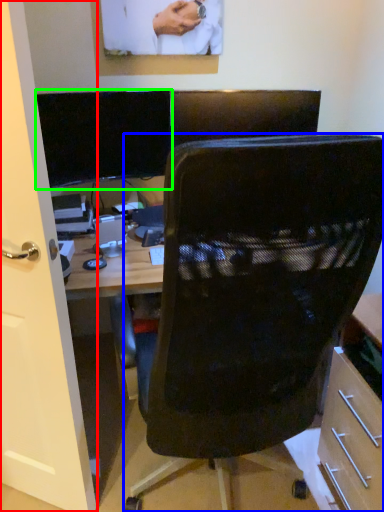
Question: Which object is the closest to the glass door (highlighted by a red box)? Choose among these: chair (highlighted by a blue box) or computer monitor (highlighted by a green box).

Choices:
 (A) chair
 (B) computer monitor

Answer: (A)